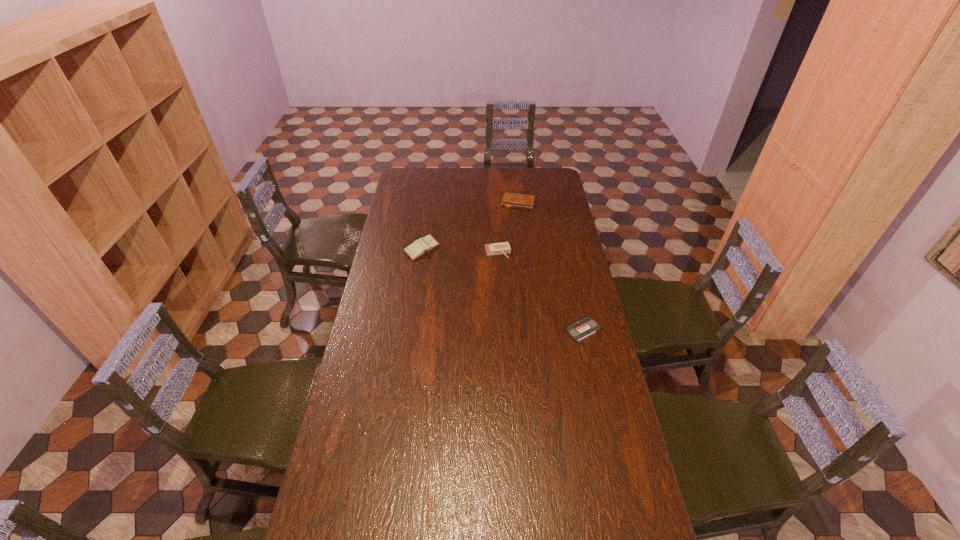
This screenshot has height=540, width=960. In order to click on vacant area located 0.100m on the spine side of the farther diary in this screenshot , I will do `click(513, 221)`.

This screenshot has width=960, height=540. Find the location of `vacant space located 0.130m on the spine side of the farther diary`. vacant space located 0.130m on the spine side of the farther diary is located at coordinates (512, 225).

Locate an element on the screen. The height and width of the screenshot is (540, 960). vacant space located on the striking surface of the second tallest object is located at coordinates (510, 285).

Locate an element on the screen. This screenshot has height=540, width=960. free space located 0.340m on the striking surface of the second tallest object is located at coordinates click(x=519, y=312).

You are a GUI agent. You are given a task and a screenshot of the screen. Output one action in this format:
    pyautogui.click(x=<x>, y=<y>)
    Task: Click on the vacant space located on the striking surface of the second tallest object
    The height and width of the screenshot is (540, 960).
    Given the screenshot: What is the action you would take?
    pyautogui.click(x=508, y=279)

Find the location of a particular element. object situated at the left edge is located at coordinates (419, 247).

Locate an element on the screen. This screenshot has width=960, height=540. videotape that is at the right edge is located at coordinates (587, 326).

Identify the location of diary located at the right edge. (512, 200).

The width and height of the screenshot is (960, 540). What are the coordinates of `free region at the far edge of the desktop` in the screenshot? It's located at (529, 187).

Locate an element on the screen. The width and height of the screenshot is (960, 540). free spot at the left edge of the desktop is located at coordinates (411, 210).